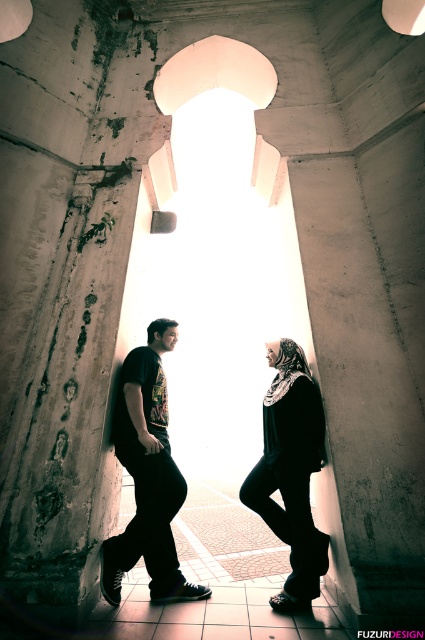
You are holding a camera and want to take a photo of the matte black clothing at center. The camera requires a minimum distance of 10 feet to focus properly. Can you take the photo while standing at your current position?

The matte black clothing at center and camera are 10.01 feet apart, which is slightly more than the required 10 feet. Therefore, you can take the photo while standing at your current position.